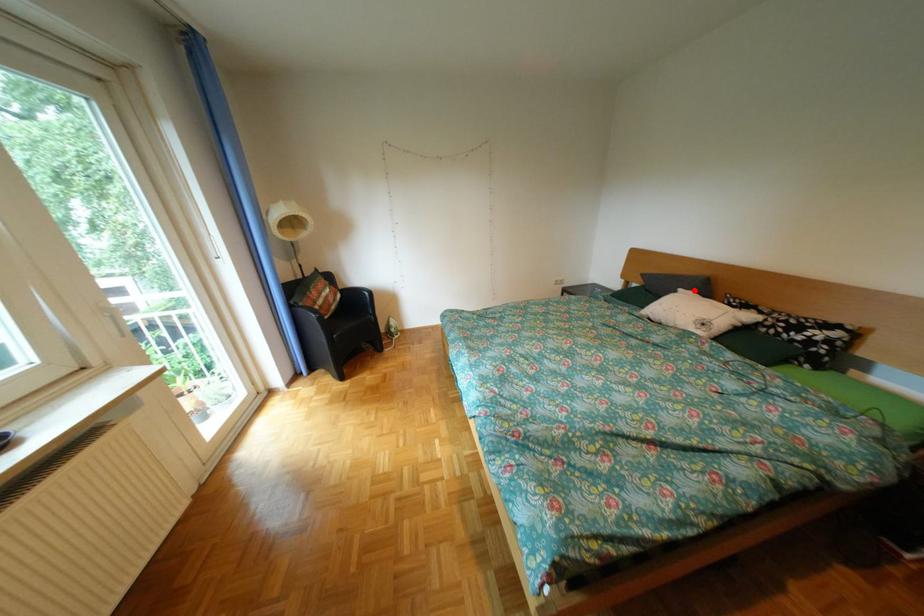
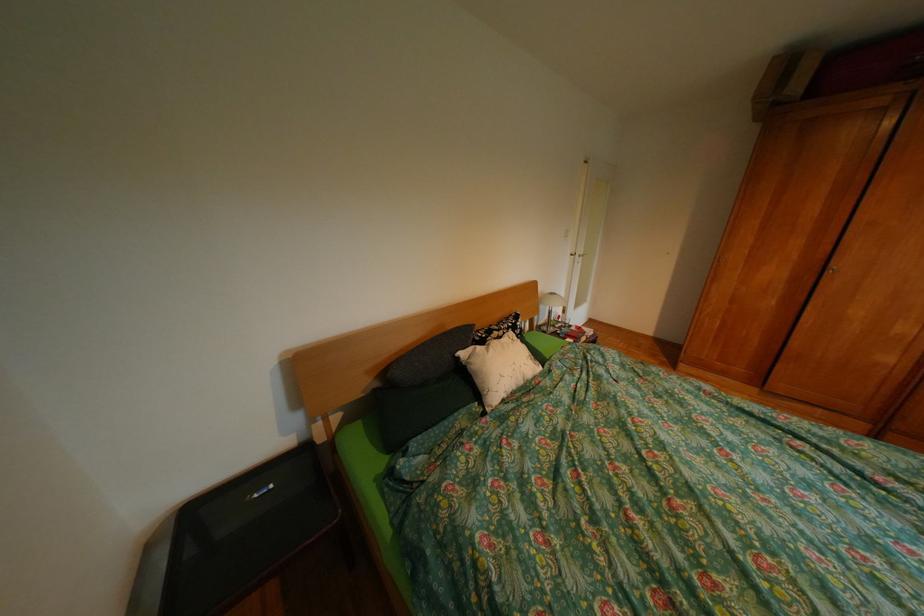
Locate, in the second image, the point that corresponds to the highlighted location in the first image.

(477, 354)